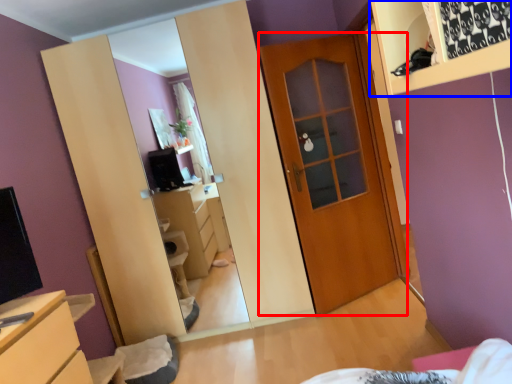
Question: Which of the following is the closest to the observer, door (highlighted by a red box) or shelf (highlighted by a blue box)?

Choices:
 (A) door
 (B) shelf

Answer: (B)